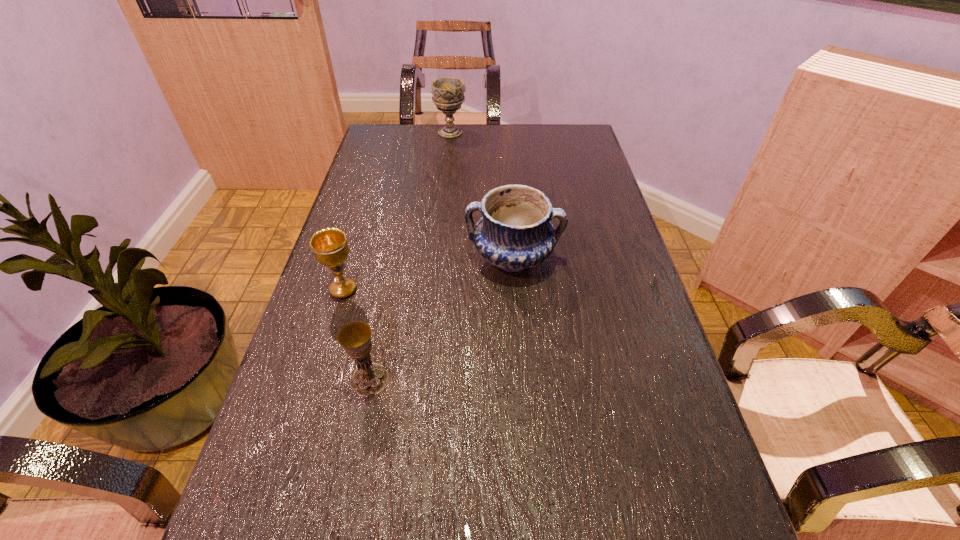
This screenshot has height=540, width=960. I want to click on the rightmost chalice, so click(448, 92).

Where is `the farthest object`? This screenshot has width=960, height=540. the farthest object is located at coordinates (448, 92).

Locate an element on the screen. This screenshot has height=540, width=960. pottery is located at coordinates (515, 233).

This screenshot has height=540, width=960. What are the coordinates of `the leftmost object` in the screenshot? It's located at click(330, 247).

What are the coordinates of `the leftmost chalice` in the screenshot? It's located at (330, 247).

The height and width of the screenshot is (540, 960). What are the coordinates of `the second chalice from right to left` in the screenshot? It's located at (369, 378).

At what (x,y) coordinates should I click in order to perform the action: click on the nearest object. Please return your answer as a coordinate pair (x, y). Looking at the image, I should click on (369, 378).

Locate an element on the screen. This screenshot has height=540, width=960. free space located on the left of the farthest chalice is located at coordinates (409, 132).

Find the location of a particular element. The height and width of the screenshot is (540, 960). vacant space located 0.170m on the left of the rightmost object is located at coordinates (398, 258).

Find the location of a particular element. The image size is (960, 540). vacant space located 0.150m on the back of the leftmost object is located at coordinates (359, 238).